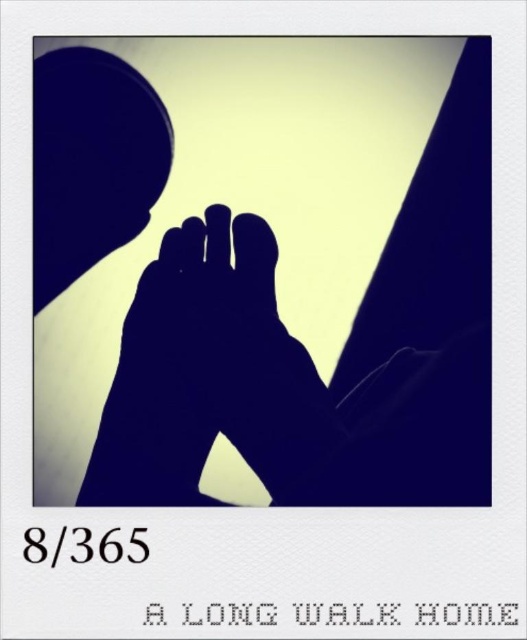
Where are the black matte feet at center located in the image?

The black matte feet at center are located at point coordinates of approximately 0.439 on the x axis and 0.529 on the y axis.

You are looking at a vintage Polaroid photo and see the black matte feet at center and the black matte hand at center. Which object is closer to the front of the photo?

The black matte feet at center is in front of the black matte hand at center, so the black matte feet at center is closer to the front of the photo.

In the scene shown: You are trying to determine the orientation of the figure in the photo. Since both the black matte feet at center and the black matte hand at center are present, which one is positioned higher up in the image?

The black matte feet at center is taller than the black matte hand at center, so the feet are positioned higher up in the image.